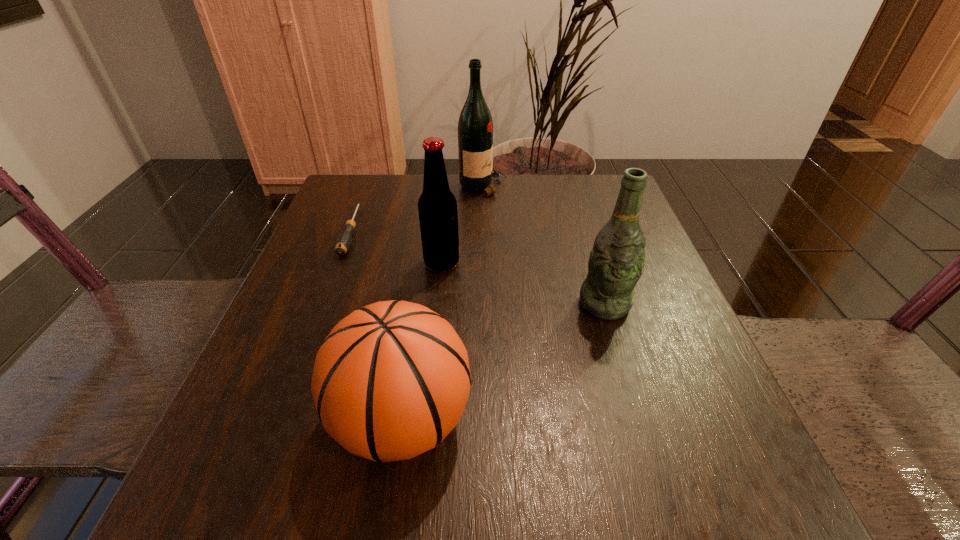
Identify the location of wine bottle. (475, 127).

Where is `the nearer beer bottle`? This screenshot has width=960, height=540. the nearer beer bottle is located at coordinates (616, 261).

Find the location of a particular element. the second nearest object is located at coordinates (616, 261).

Where is `the left beer bottle`? The height and width of the screenshot is (540, 960). the left beer bottle is located at coordinates (437, 206).

In order to click on basketball in this screenshot , I will do `click(391, 380)`.

You are a GUI agent. You are given a task and a screenshot of the screen. Output one action in this format:
    pyautogui.click(x=<x>, y=<y>)
    Task: Click on the nearest object
    The height and width of the screenshot is (540, 960).
    Given the screenshot: What is the action you would take?
    pyautogui.click(x=391, y=380)

Where is `the shortest object`? This screenshot has height=540, width=960. the shortest object is located at coordinates (344, 240).

Identify the location of the leftmost object. (344, 240).

Where is `vacant space located on the front of the wine bottle`? Image resolution: width=960 pixels, height=540 pixels. vacant space located on the front of the wine bottle is located at coordinates (484, 281).

The image size is (960, 540). What are the coordinates of `vacant area situated 0.130m on the surface of the rightmost object` in the screenshot? It's located at (629, 384).